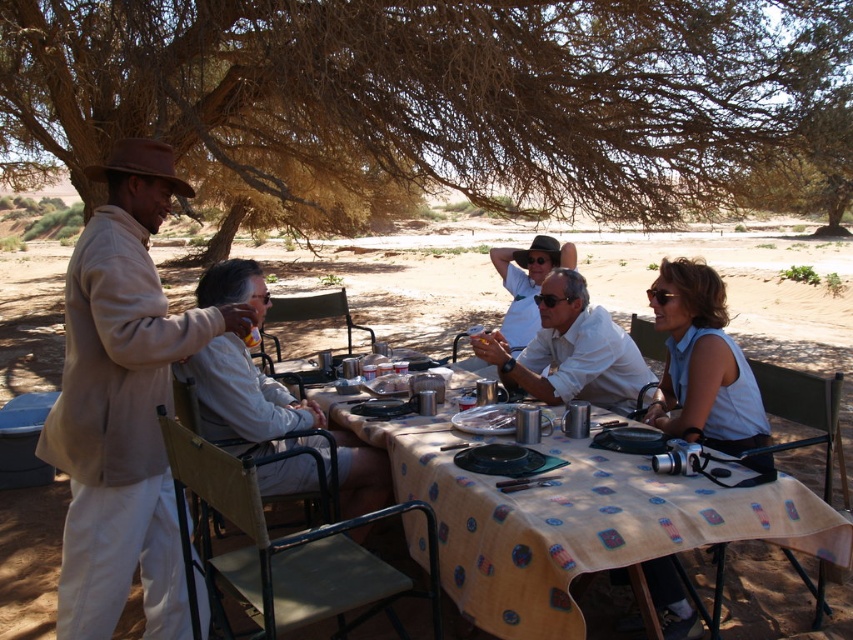
You are a photographer aiming to capture a group photo of the beige cotton shirt at left and the brown textured tree at upper center. Given the height difference between them, would you need to adjust your camera angle to include both in the frame?

The brown textured tree at upper center is much taller than the beige cotton shirt at left, so you would need to lower your camera angle to ensure both are fully visible in the frame.

You are standing at the center of the desert scene. There is a yellow fabric table at center located at point (575,522). Can you tell me the exact coordinates of the yellow fabric table at center?

The yellow fabric table at center is located at point (575,522).